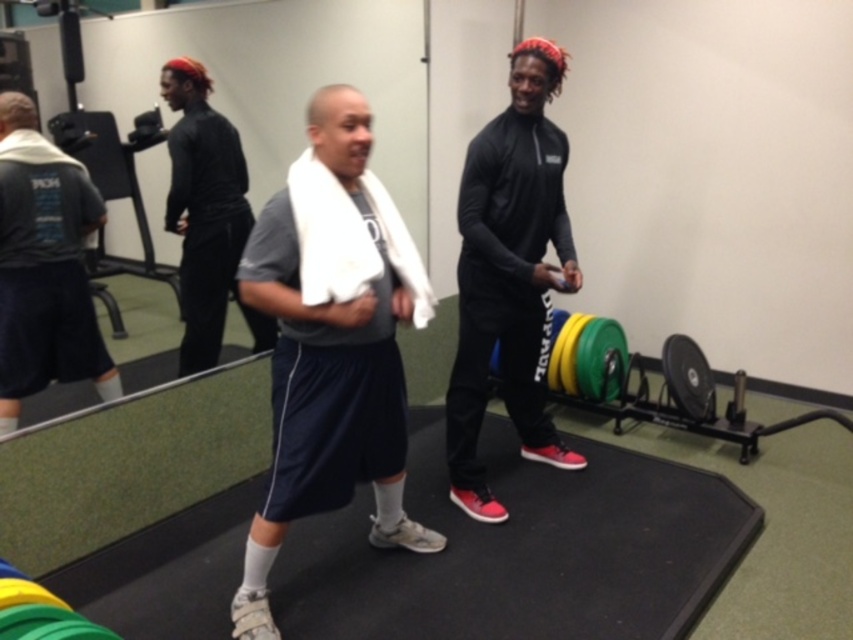
Is black matte athletic wear at center further to camera compared to black matte shirt at center?

No, black matte athletic wear at center is in front of black matte shirt at center.

Can you confirm if black matte athletic wear at center is positioned above black matte shirt at center?

No, black matte athletic wear at center is not above black matte shirt at center.

Does point (467, 307) come behind point (190, 268)?

No, it is in front of (190, 268).

Identify the location of black matte athletic wear at center. (509, 275).

Can you confirm if gray cotton t-shirt at left is smaller than black matte shirt at center?

Indeed, gray cotton t-shirt at left has a smaller size compared to black matte shirt at center.

Is gray cotton t-shirt at left above black matte shirt at center?

Actually, gray cotton t-shirt at left is below black matte shirt at center.

This screenshot has width=853, height=640. Describe the element at coordinates (44, 266) in the screenshot. I see `gray cotton t-shirt at left` at that location.

Identify the location of gray cotton t-shirt at left. (44, 266).

Who is positioned more to the left, white fabric towel at center or gray cotton t-shirt at left?

gray cotton t-shirt at left is more to the left.

Identify the location of white fabric towel at center. point(331,344).

Image resolution: width=853 pixels, height=640 pixels. What are the coordinates of `white fabric towel at center` in the screenshot? It's located at tap(331, 344).